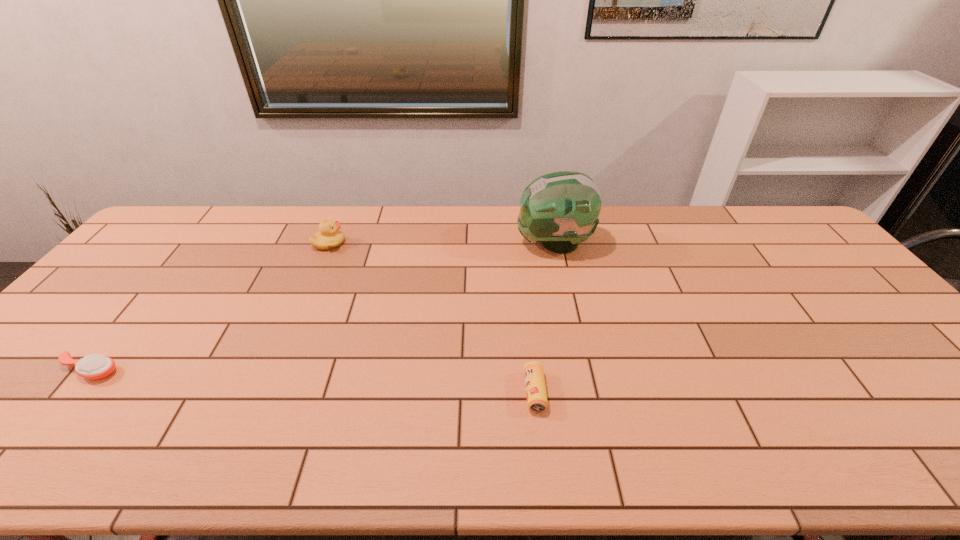
At what (x,y) coordinates should I click in order to perform the action: click on football helmet. Please return your answer as a coordinate pair (x, y). The width and height of the screenshot is (960, 540). Looking at the image, I should click on (560, 209).

At what (x,y) coordinates should I click in order to perform the action: click on the third object from right to left. Please return your answer as a coordinate pair (x, y). This screenshot has height=540, width=960. Looking at the image, I should click on (329, 237).

Where is `duckling`? This screenshot has height=540, width=960. duckling is located at coordinates (329, 237).

What are the coordinates of `beer can` in the screenshot? It's located at (536, 395).

The height and width of the screenshot is (540, 960). Identify the location of the leftmost object. (96, 366).

Find the location of `vacant area located 0.330m on the visor of the tallest object`. vacant area located 0.330m on the visor of the tallest object is located at coordinates pos(416,244).

I want to click on free space located 0.170m on the visor of the tallest object, so click(465, 244).

This screenshot has width=960, height=540. In order to click on vacant space situated on the visor of the tallest object in this screenshot , I will do `click(413, 244)`.

Identify the location of vacant point located on the front-facing side of the second object from left to right. (444, 243).

Locate an element on the screen. Image resolution: width=960 pixels, height=540 pixels. free point located 0.240m on the back of the beer can is located at coordinates (525, 302).